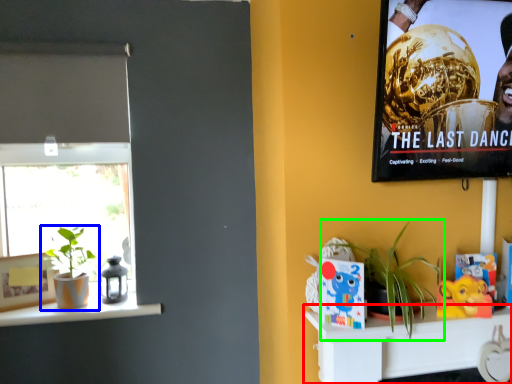
Question: Considering the real-world distances, which object is closest to shelf (highlighted by a red box)? houseplant (highlighted by a blue box) or houseplant (highlighted by a green box).

Choices:
 (A) houseplant
 (B) houseplant

Answer: (B)